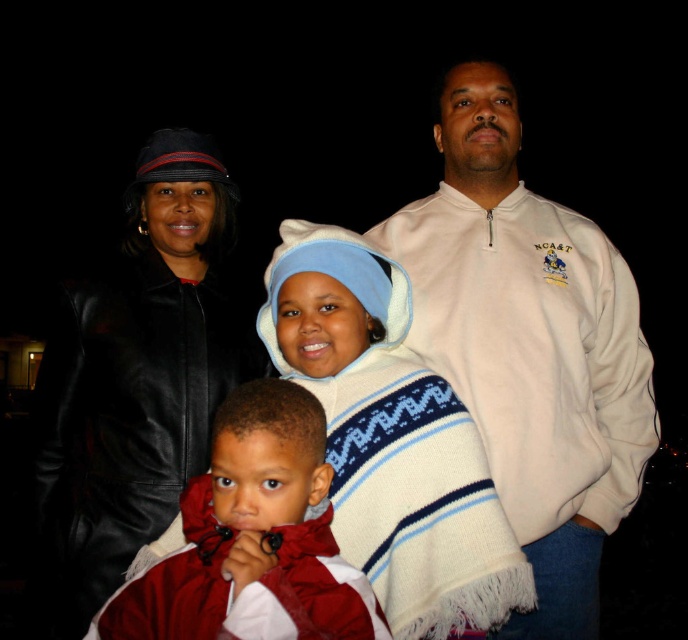
You are standing in the image and want to touch the point at coordinates (528, 346). What object will your finger land on?

The point at coordinates (528, 346) is on the white fleece jacket at upper right.

You are trying to decide which jacket to wear for a cold evening. You notice the white knitted sweater at center and the red fleece jacket at center in the image. Which one appears larger?

The white knitted sweater at center is bigger than the red fleece jacket at center, so the white knitted sweater at center would be the larger option.

In the nighttime family photo, there is a point marked at coordinates (528,346). What object is located at this point?

The point at coordinates (528,346) marks the white fleece jacket at upper right.